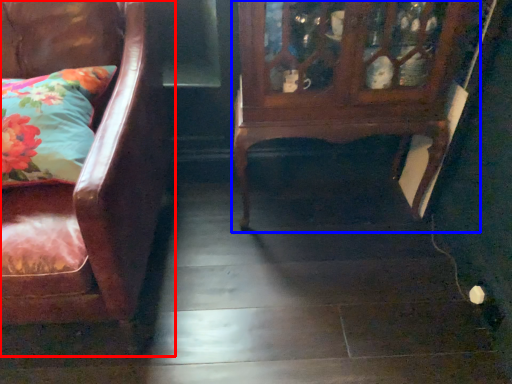
Question: Which point is closer to the camera, chair (highlighted by a red box) or furniture (highlighted by a blue box)?

Choices:
 (A) chair
 (B) furniture

Answer: (A)